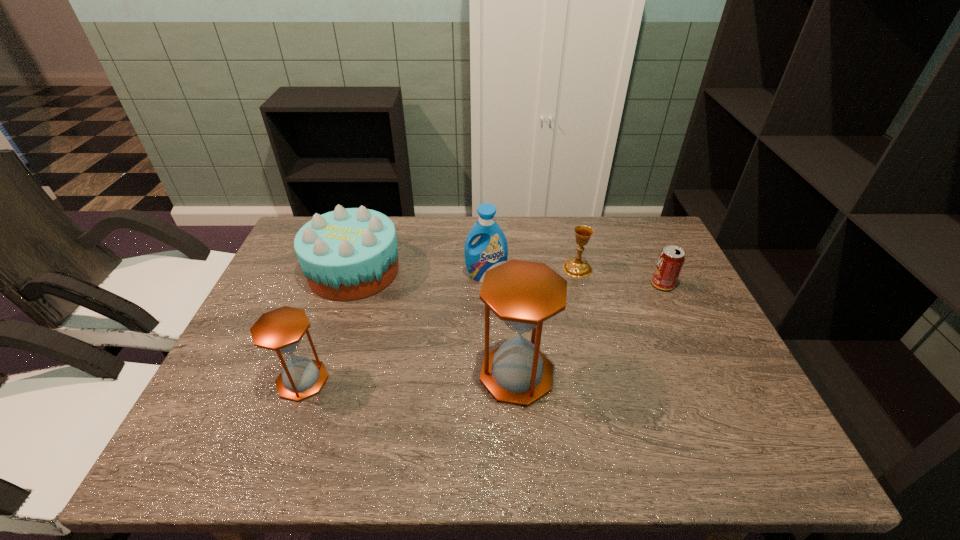
Where is `object at the near left corner`? object at the near left corner is located at coordinates (281, 330).

I want to click on vacant space at the far edge of the desktop, so click(x=438, y=222).

Find the location of a particular element. free region at the near edge is located at coordinates (292, 417).

Locate an element on the screen. free space at the left edge of the desktop is located at coordinates (256, 313).

Find the location of a particular element. vacant space at the right edge is located at coordinates (685, 323).

The width and height of the screenshot is (960, 540). I want to click on vacant area at the far left corner of the desktop, so click(x=300, y=227).

Locate an element on the screen. Image resolution: width=960 pixels, height=540 pixels. free space between the second object from right to left and the rightmost object is located at coordinates (620, 276).

Identify the location of free area in between the shortest object and the second tallest object. This screenshot has width=960, height=540. (574, 280).

Identify the location of vacant point located between the right hourglass and the shorter hourglass. (410, 377).

At what (x,y) coordinates should I click in order to perform the action: click on free space that is in between the cake and the fifth object from left to right. Please return your answer as a coordinate pair (x, y). Looking at the image, I should click on (466, 269).